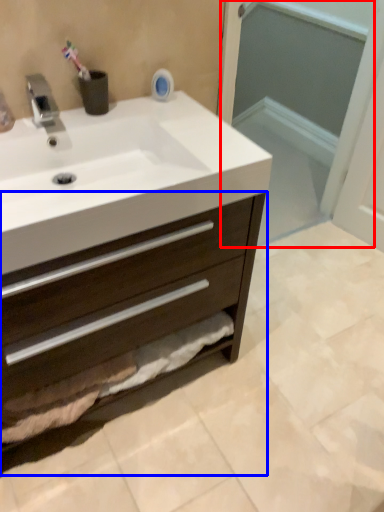
Question: Which object is further to the camera taking this photo, screen door (highlighted by a red box) or bathroom cabinet (highlighted by a blue box)?

Choices:
 (A) screen door
 (B) bathroom cabinet

Answer: (A)